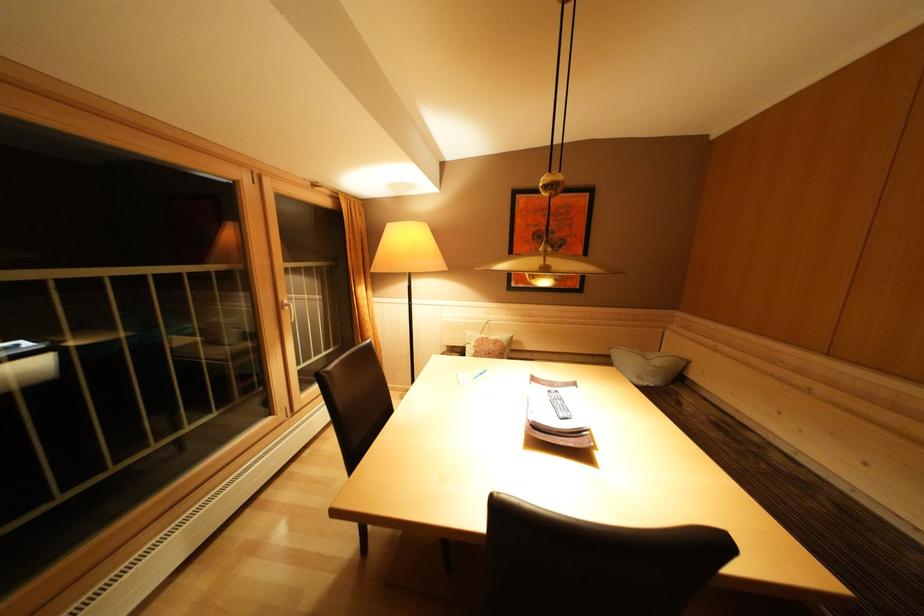
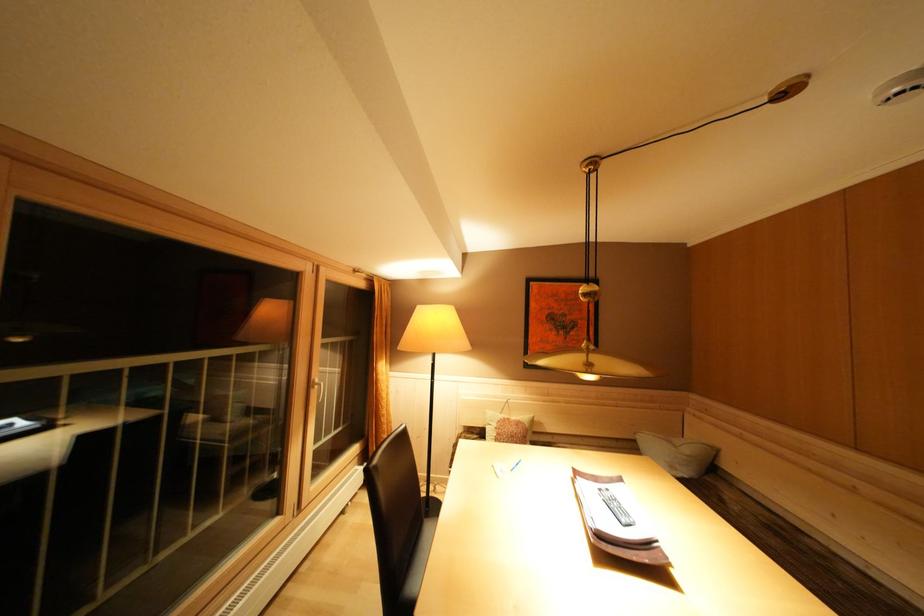
Locate, in the second image, the point that corresponds to point (664, 368) in the first image.

(695, 456)